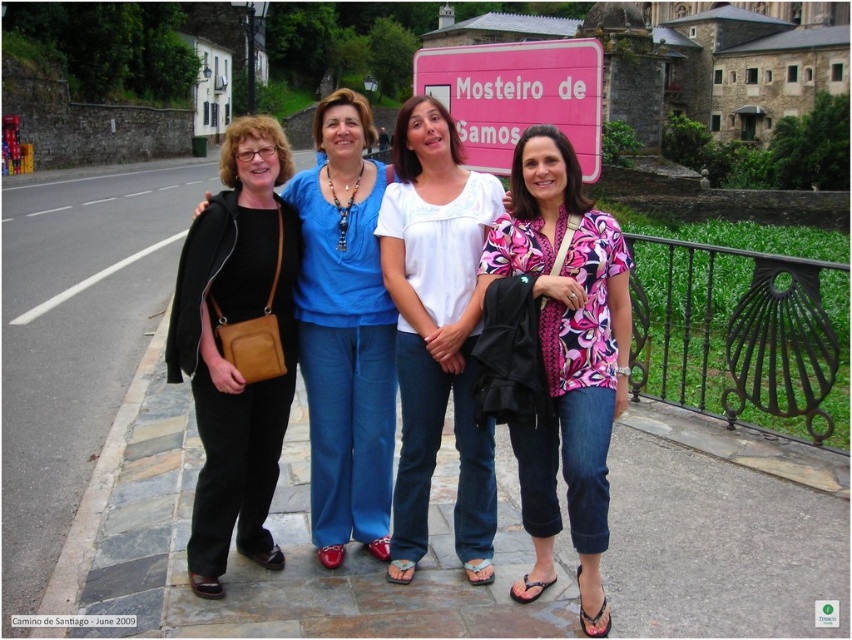
Question: Which object is positioned closest to the pink floral blouse at center?

Choices:
 (A) white cotton blouse at center
 (B) black leather pants at left

Answer: (A)

Question: Is matte black jacket at center to the left of gray stone curb at lower left from the viewer's perspective?

Choices:
 (A) yes
 (B) no

Answer: (B)

Question: Among these points, which one is farthest from the camera?

Choices:
 (A) (274, 556)
 (B) (378, 164)
 (C) (586, 225)

Answer: (B)

Question: Does pink floral blouse at center have a larger size compared to white cotton blouse at center?

Choices:
 (A) no
 (B) yes

Answer: (A)

Question: Observing the image, what is the correct spatial positioning of white cotton blouse at center in reference to gray stone curb at lower left?

Choices:
 (A) right
 (B) left

Answer: (A)

Question: Which point is farther to the camera?

Choices:
 (A) matte black jacket at center
 (B) gray stone curb at lower left
 (C) white cotton blouse at center

Answer: (A)